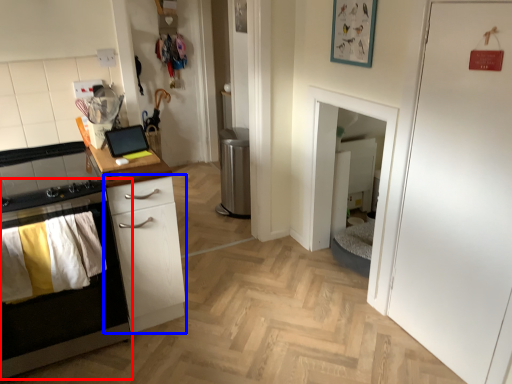
Question: Which object appears closest to the camera in this image, cabinetry (highlighted by a red box) or chest of drawers (highlighted by a blue box)?

Choices:
 (A) cabinetry
 (B) chest of drawers

Answer: (A)